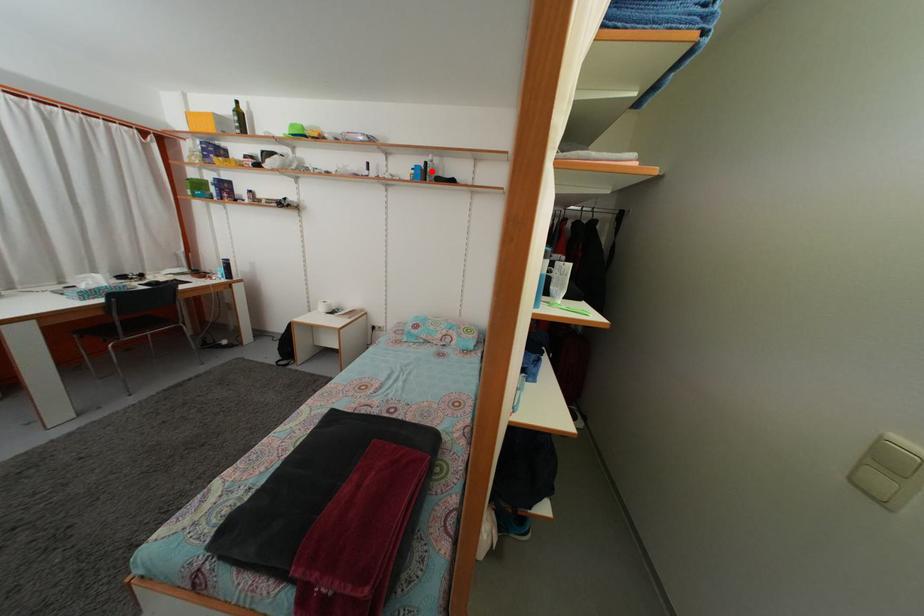
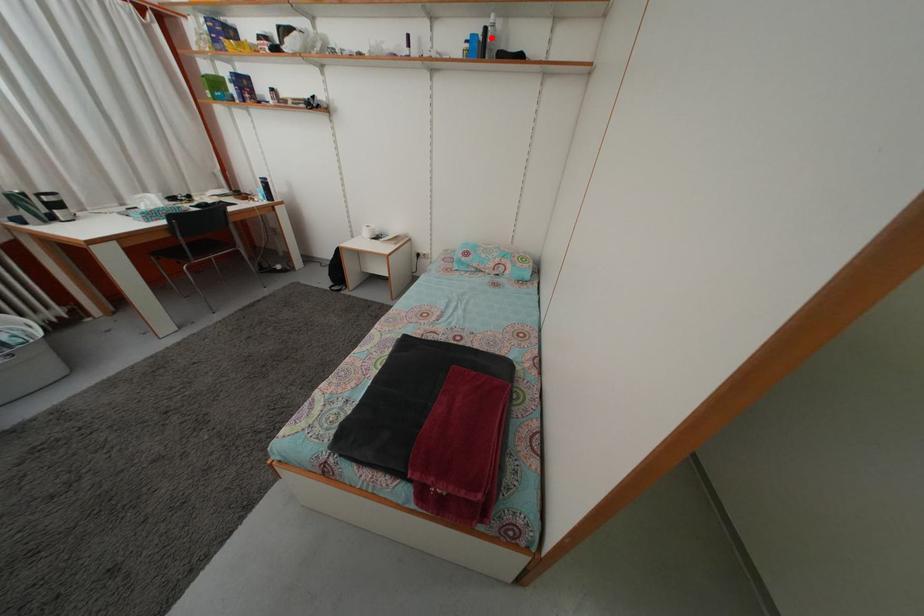
I am providing you with two images of the same scene from different viewpoints. A red point is marked on the first image and another point is marked on the second image. Is the marked point in image1 the same physical position as the marked point in image2?

Yes